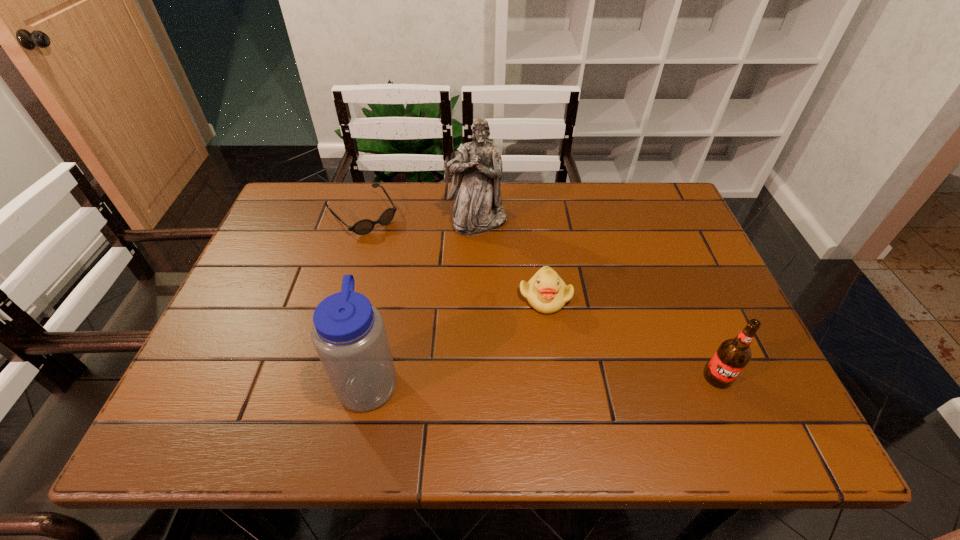
The width and height of the screenshot is (960, 540). I want to click on sunglasses positioned at the far edge, so click(365, 226).

Locate an element on the screen. water bottle located in the near edge section of the desktop is located at coordinates (349, 335).

I want to click on root beer that is at the near edge, so click(x=732, y=356).

Find the location of a particular element. object that is at the left edge is located at coordinates (365, 226).

At what (x,y) coordinates should I click in order to perform the action: click on object that is positioned at the right edge. Please return your answer as a coordinate pair (x, y). Looking at the image, I should click on (732, 356).

Locate an element on the screen. The width and height of the screenshot is (960, 540). object present at the far left corner is located at coordinates (365, 226).

You are a GUI agent. You are given a task and a screenshot of the screen. Output one action in this format:
    pyautogui.click(x=<x>, y=<y>)
    Task: Click on the object at the near right corner
    The image size is (960, 540).
    Given the screenshot: What is the action you would take?
    pyautogui.click(x=732, y=356)

At what (x,y) coordinates should I click in order to perform the action: click on free location at the far edge of the desktop. Please return your answer as a coordinate pair (x, y). This screenshot has height=540, width=960. Looking at the image, I should click on (382, 207).

You are a GUI agent. You are given a task and a screenshot of the screen. Output one action in this format:
    pyautogui.click(x=<x>, y=<y>)
    Task: Click on the free location at the near edge of the desktop
    
    Given the screenshot: What is the action you would take?
    pyautogui.click(x=669, y=369)

The image size is (960, 540). Identify the location of vacant space at the right edge of the desktop. (702, 288).